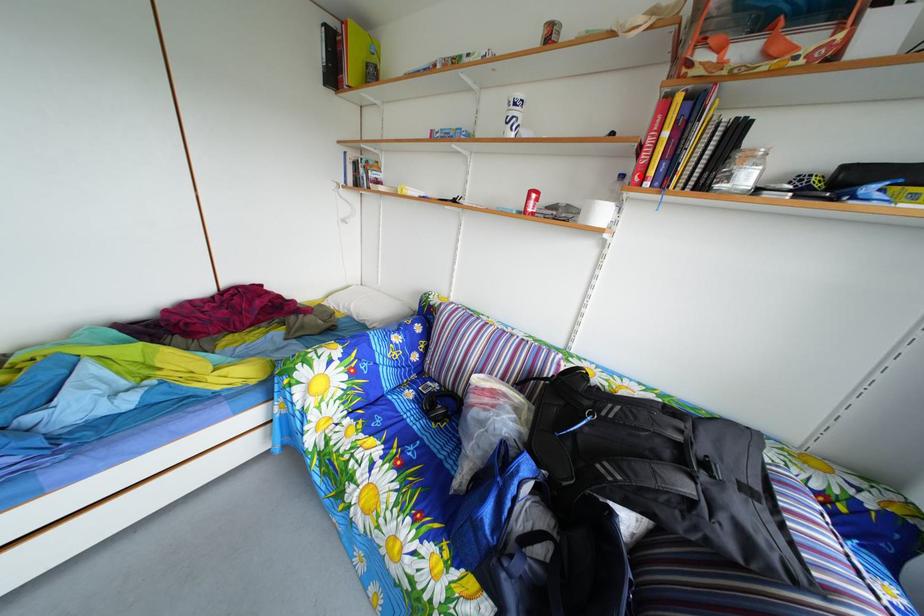
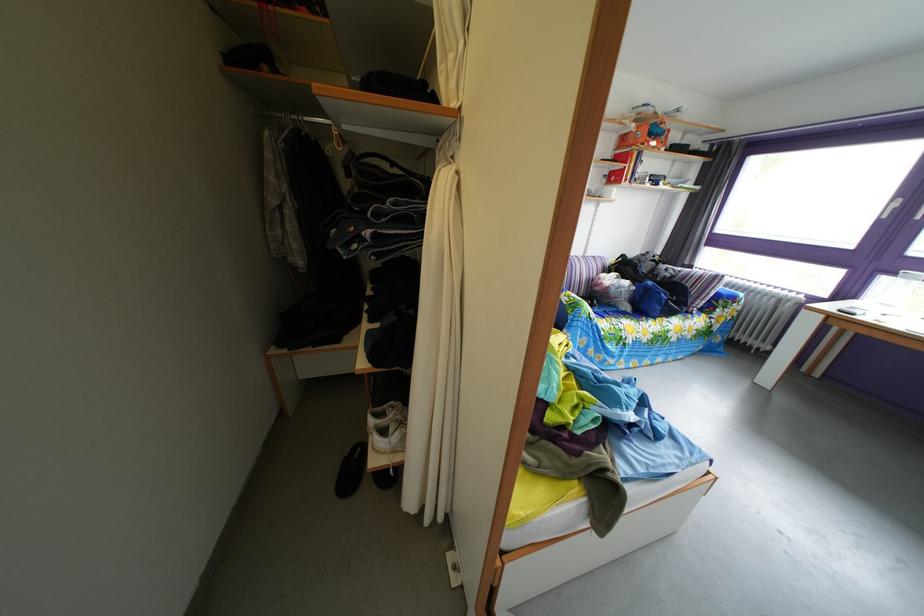
Question: I am providing you with two images of the same scene from different viewpoints. A red point is shown in image1. For the corresponding object point in image2, is it positioned nearer or farther from the camera?

Choices:
 (A) Nearer
 (B) Farther

Answer: (A)